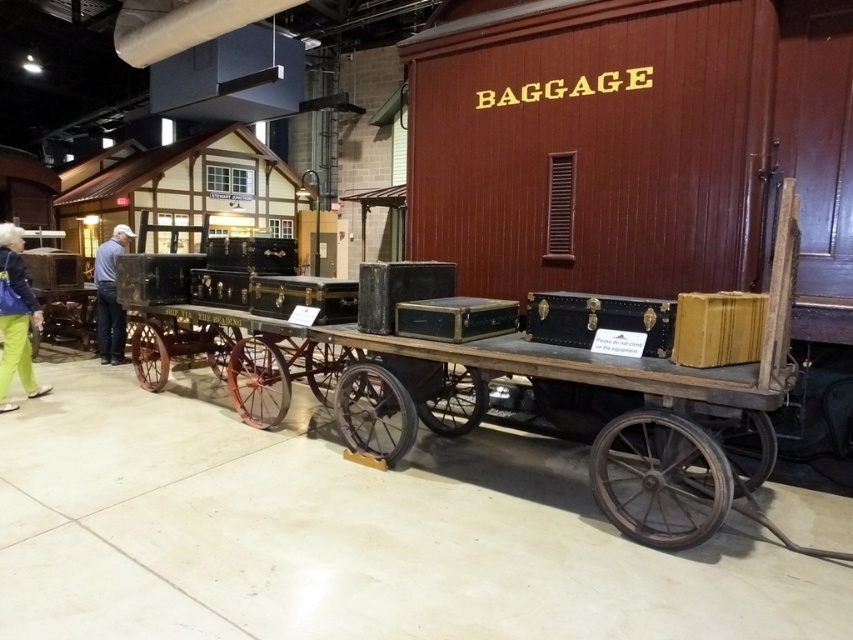
Is point (20, 356) closer to camera compared to point (113, 280)?

Yes.

Between green fabric bag at lower left and blue jeans at left, which one is positioned lower?

green fabric bag at lower left is below.

Describe the element at coordinates (15, 317) in the screenshot. I see `green fabric bag at lower left` at that location.

Find the location of a particular element. Image resolution: width=853 pixels, height=640 pixels. green fabric bag at lower left is located at coordinates (15, 317).